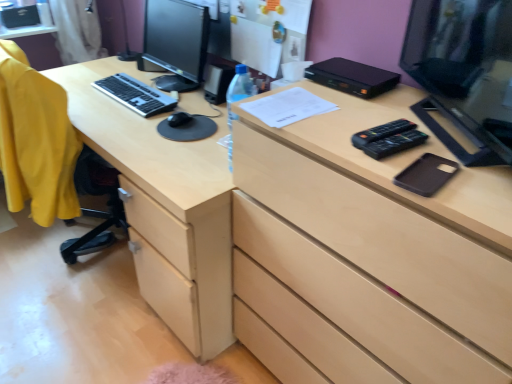
Where is `vacant space underneath matte black monitor at center left, marked as the second computer monitor in a right-to-left arrangement (from a real-world perspective)`? This screenshot has width=512, height=384. vacant space underneath matte black monitor at center left, marked as the second computer monitor in a right-to-left arrangement (from a real-world perspective) is located at coordinates (186, 85).